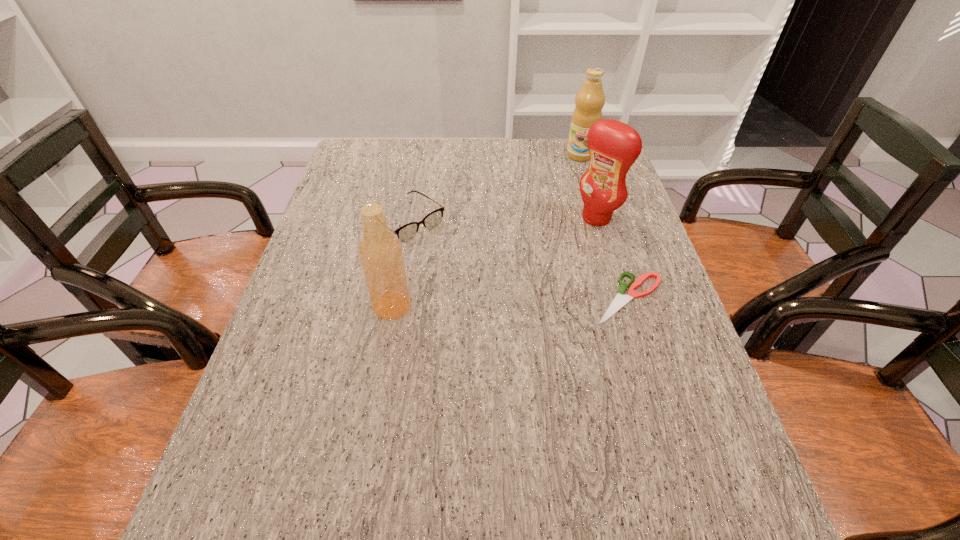
Identify the location of beer bottle. The height and width of the screenshot is (540, 960). (380, 253).

Locate an element on the screen. the shortest object is located at coordinates (620, 300).

I want to click on the second shortest object, so (407, 232).

The width and height of the screenshot is (960, 540). I want to click on condiment, so click(x=614, y=146).

At what (x,y) coordinates should I click in order to perform the action: click on the farthest object. Please return your answer as a coordinate pair (x, y). This screenshot has width=960, height=540. Looking at the image, I should click on (590, 99).

Image resolution: width=960 pixels, height=540 pixels. What are the coordinates of `free space located on the front of the beer bottle` in the screenshot? It's located at (384, 351).

Locate an element on the screen. This screenshot has width=960, height=540. vacant position located on the front of the shortest object is located at coordinates (666, 417).

Where is `free space located 0.220m on the face of the spectacles`? free space located 0.220m on the face of the spectacles is located at coordinates (483, 287).

This screenshot has height=540, width=960. I want to click on vacant space located on the face of the spectacles, so click(526, 324).

Find the location of a particular element. vacant space located 0.110m on the face of the spectacles is located at coordinates (455, 262).